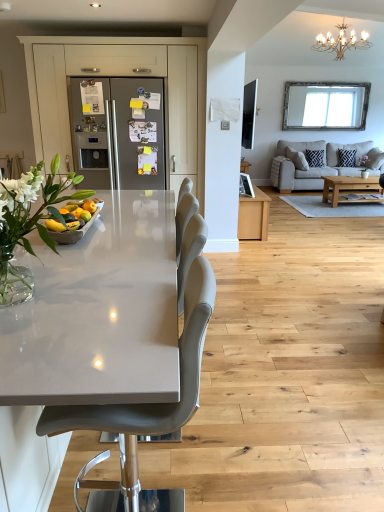
Identify the location of free area below clear glass vase at center (from a real-world perspective). pos(35,297).